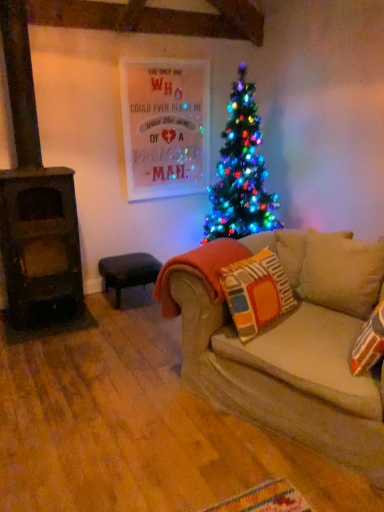
Question: Does velvet dark blue stool at lower left have a greater height compared to orange fleece blanket at center?

Choices:
 (A) yes
 (B) no

Answer: (B)

Question: Is velvet dark blue stool at lower left not near orange fleece blanket at center?

Choices:
 (A) yes
 (B) no

Answer: (B)

Question: Does velvet dark blue stool at lower left have a lesser height compared to orange fleece blanket at center?

Choices:
 (A) yes
 (B) no

Answer: (A)

Question: Is velvet dark blue stool at lower left looking in the opposite direction of orange fleece blanket at center?

Choices:
 (A) yes
 (B) no

Answer: (B)

Question: Are velvet dark blue stool at lower left and orange fleece blanket at center making contact?

Choices:
 (A) yes
 (B) no

Answer: (B)

Question: From a real-world perspective, is velvet dark blue stool at lower left on top of orange fleece blanket at center?

Choices:
 (A) yes
 (B) no

Answer: (B)

Question: Can you confirm if orange fleece blanket at center is smaller than velvet dark blue stool at lower left?

Choices:
 (A) no
 (B) yes

Answer: (B)

Question: Is orange fleece blanket at center bigger than velvet dark blue stool at lower left?

Choices:
 (A) no
 (B) yes

Answer: (A)

Question: From the image's perspective, is orange fleece blanket at center located above velvet dark blue stool at lower left?

Choices:
 (A) yes
 (B) no

Answer: (A)

Question: Is there a large distance between orange fleece blanket at center and velvet dark blue stool at lower left?

Choices:
 (A) no
 (B) yes

Answer: (A)

Question: Is orange fleece blanket at center not inside velvet dark blue stool at lower left?

Choices:
 (A) yes
 (B) no

Answer: (A)

Question: From the image's perspective, is orange fleece blanket at center located beneath velvet dark blue stool at lower left?

Choices:
 (A) no
 (B) yes

Answer: (A)

Question: From the image's perspective, is orange fleece blanket at center positioned above or below velvet dark blue stool at lower left?

Choices:
 (A) below
 (B) above

Answer: (B)